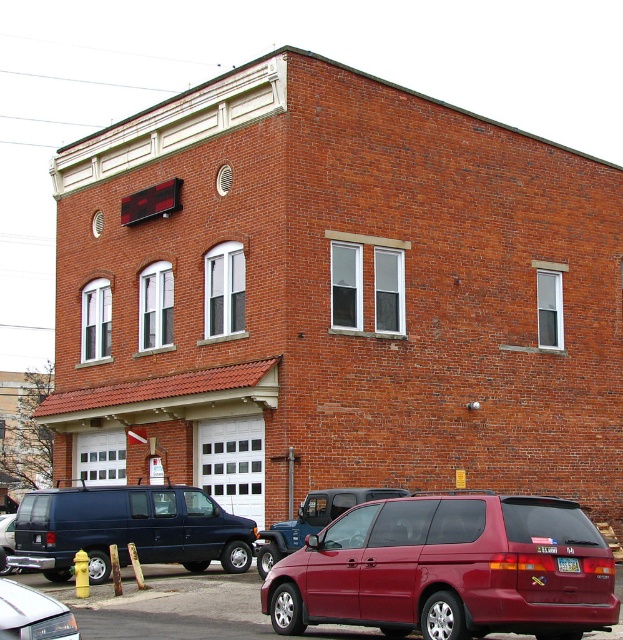
You are standing at the entrance of the two story brick building and want to park your car. There is a matte black van at lower left at point (126, 529). Is there enough space to park your car next to the matte black van at lower left?

The matte black van at lower left is located at point (126, 529). Without specific information about the parking area dimensions or the size of the available space next to the van, it is impossible to determine if there is enough space to park your car next to the matte black van at lower left.

You are standing in front of the two story brick building. There is a vehicle in the parking area. What color is the vehicle located at point (x=449, y=570)?

The vehicle at point (x=449, y=570) is a maroon matte minivan at lower right.